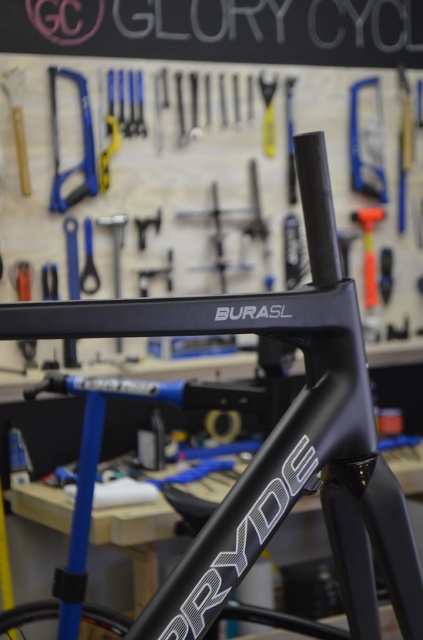
Does matte black tools at upper center have a lesser width compared to black glossy frame at center?

No, matte black tools at upper center is not thinner than black glossy frame at center.

Can you confirm if matte black tools at upper center is shorter than black glossy frame at center?

No.

Does point (233, 90) come in front of point (255, 509)?

No, (233, 90) is further to viewer.

In order to click on matte black tools at upper center in this screenshot , I will do `click(216, 131)`.

Is blue plastic saw at upper left behind metallic blue screwdriver at upper center?

No, it is in front of metallic blue screwdriver at upper center.

Is blue plastic saw at upper left wider than metallic blue screwdriver at upper center?

Correct, the width of blue plastic saw at upper left exceeds that of metallic blue screwdriver at upper center.

Locate an element on the screen. The image size is (423, 640). blue plastic saw at upper left is located at coordinates (84, 145).

In the scene shown: Does metallic blue screwdriver at upper center have a smaller size compared to orange plastic hammer at upper right?

Indeed, metallic blue screwdriver at upper center has a smaller size compared to orange plastic hammer at upper right.

Describe the element at coordinates (403, 145) in the screenshot. I see `metallic blue screwdriver at upper center` at that location.

You are a GUI agent. You are given a task and a screenshot of the screen. Output one action in this format:
    pyautogui.click(x=<x>, y=<y>)
    Task: Click on the metallic blue screwdriver at upper center
    
    Given the screenshot: What is the action you would take?
    pyautogui.click(x=403, y=145)